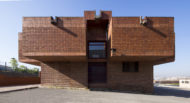
Find the location of a particular element. wall is located at coordinates (16, 77), (58, 73), (124, 75), (130, 43), (63, 43).